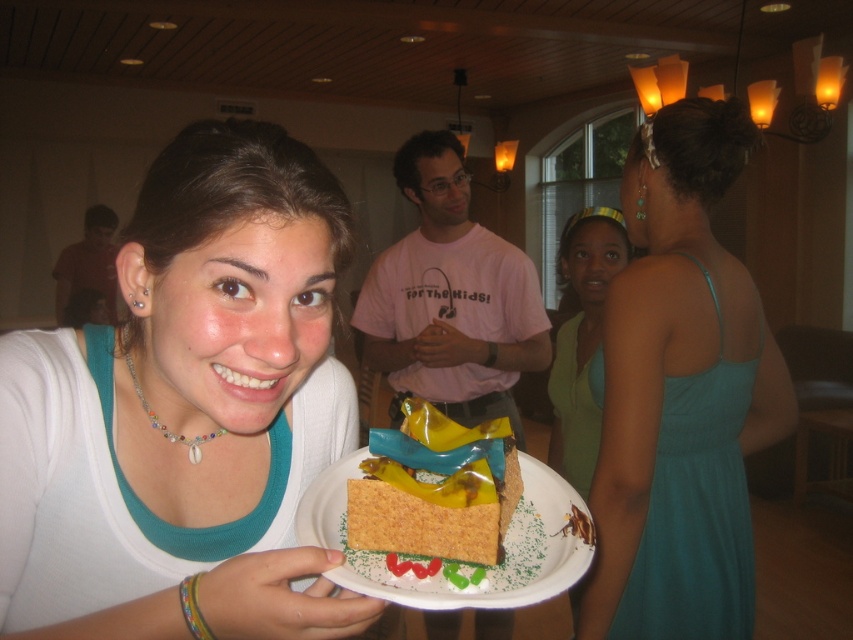
Question: Which point is farther from the camera taking this photo?

Choices:
 (A) (378, 513)
 (B) (646, 636)
 (C) (196, 202)
 (D) (479, 417)

Answer: (D)

Question: Can you confirm if matte brown cake at center is positioned below green fabric headband at upper center?

Choices:
 (A) yes
 (B) no

Answer: (A)

Question: Among these objects, which one is nearest to the camera?

Choices:
 (A) matte red shirt at left
 (B) pink cotton shirt at center

Answer: (B)

Question: Among these points, which one is farthest from the camera?

Choices:
 (A) (489, 272)
 (B) (518, 556)
 (C) (711, 600)

Answer: (A)

Question: Can you confirm if white matte shirt at center is positioned to the right of yellow matte cake at center?

Choices:
 (A) yes
 (B) no

Answer: (B)

Question: Is teal satin dress at center bigger than matte red shirt at left?

Choices:
 (A) yes
 (B) no

Answer: (B)